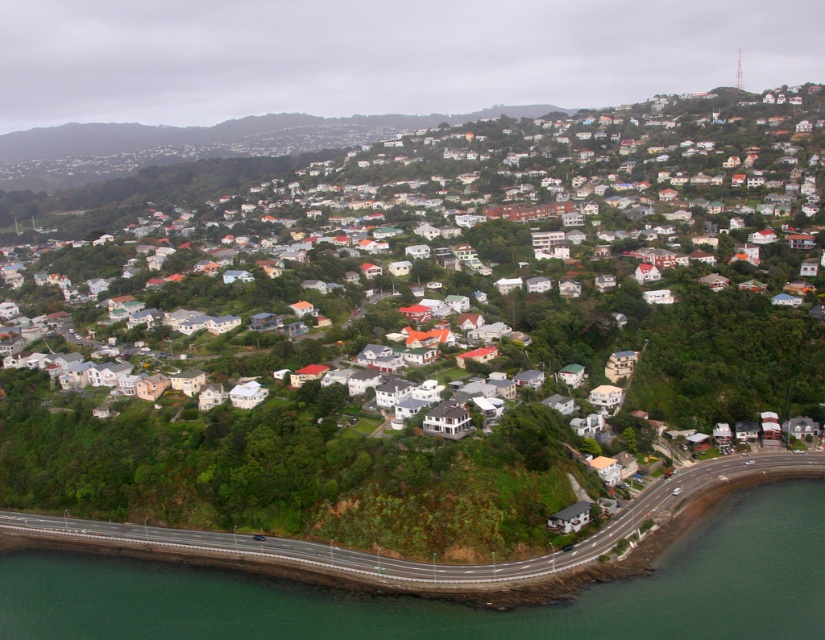
Question: Which object appears closest to the camera in this image?

Choices:
 (A) white matte houses at center
 (B) green water at lower left

Answer: (B)

Question: Is white matte houses at center below green water at lower left?

Choices:
 (A) yes
 (B) no

Answer: (B)

Question: Is white matte houses at center to the right of green water at lower left from the viewer's perspective?

Choices:
 (A) no
 (B) yes

Answer: (A)

Question: Does white matte houses at center have a greater width compared to green water at lower left?

Choices:
 (A) no
 (B) yes

Answer: (B)

Question: Among these points, which one is farthest from the camera?

Choices:
 (A) (60, 582)
 (B) (453, 150)

Answer: (B)